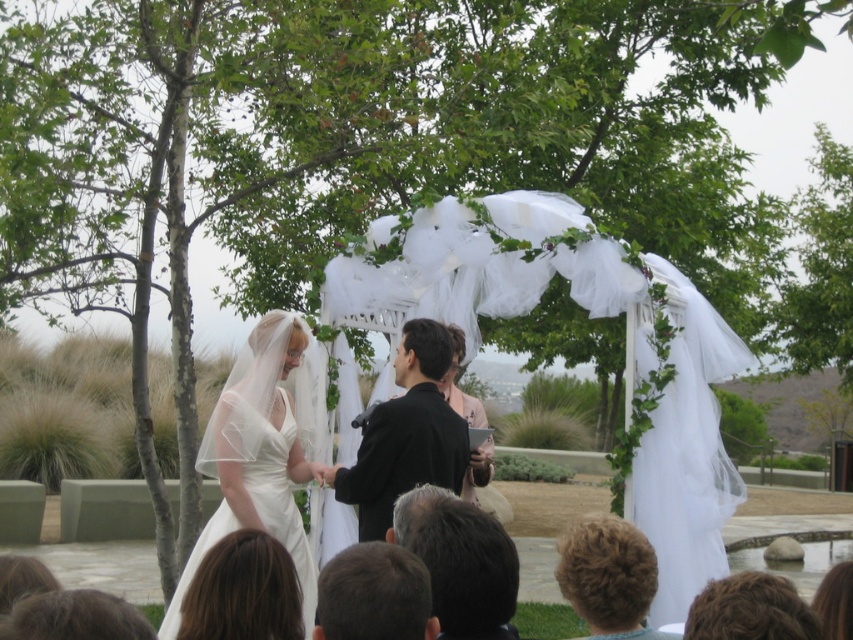
You are a photographer at the wedding ceremony. You need to capture a photo where both the white tulle canopy at center and the dark brown hair at center are visible. Based on their positions, which object should appear to the right in the photo?

The white tulle canopy at center is positioned on the right side of dark brown hair at center, so in the photo, the white tulle canopy at center should appear to the right of the dark brown hair at center.

You are a photographer positioned behind the couple at the wedding ceremony. You want to capture a clear photo of the dark brown hair at center without the white tulle canopy at center blocking it. Is this possible?

The dark brown hair at center is behind the white tulle canopy at center, so it is blocked by the canopy. Therefore, you cannot capture a clear photo of the dark brown hair at center without the white tulle canopy at center blocking it.

You are a photographer at the wedding ceremony. You need to adjust the camera focus to ensure both the white satin dress at left and the black smooth suit at center are in focus. Considering their heights, which subject should you focus on first to maximize depth of field?

The white satin dress at left is taller than the black smooth suit at center. To maximize depth of field, focus on the taller subject first, so you should focus on the white satin dress at left first.